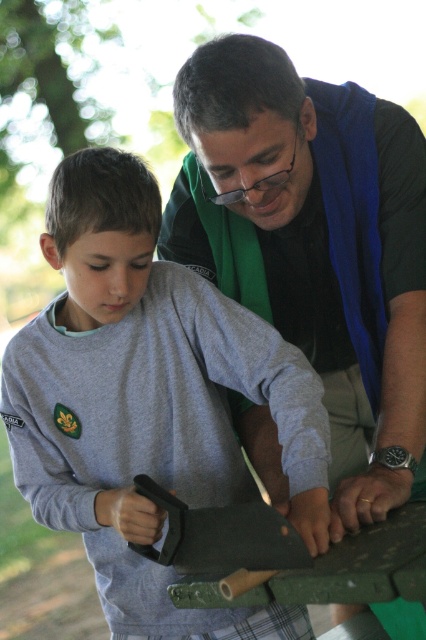
Question: Which object appears farthest from the camera in this image?

Choices:
 (A) gray cotton shirt at center
 (B) blue fabric vest at center

Answer: (A)

Question: Which point appears farthest from the camera in this image?

Choices:
 (A) (334, 301)
 (B) (81, 236)

Answer: (A)

Question: Is gray cotton shirt at center in front of blue fabric vest at center?

Choices:
 (A) no
 (B) yes

Answer: (A)

Question: Is the position of gray cotton shirt at center less distant than that of blue fabric vest at center?

Choices:
 (A) yes
 (B) no

Answer: (B)

Question: From the image, what is the correct spatial relationship of gray cotton shirt at center in relation to blue fabric vest at center?

Choices:
 (A) left
 (B) right

Answer: (A)